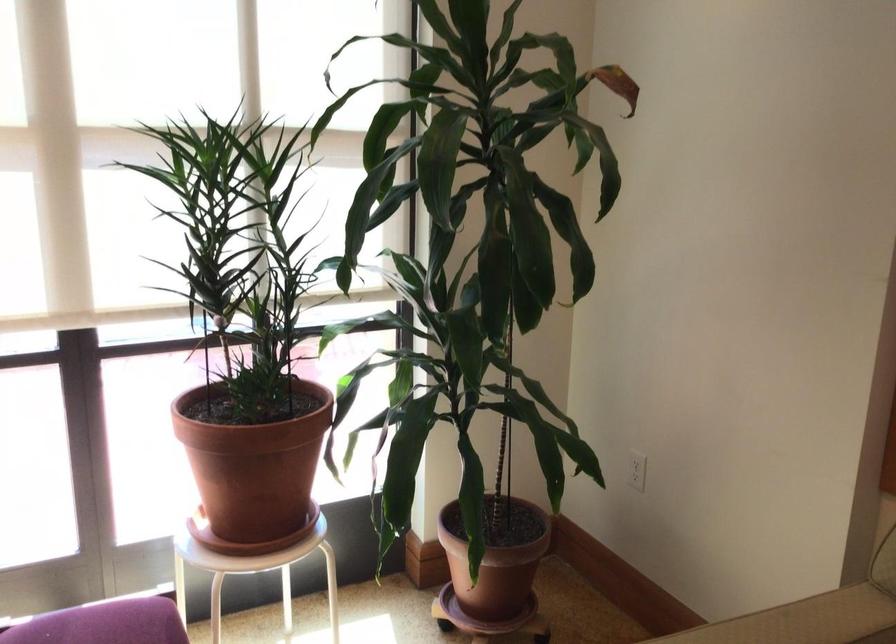
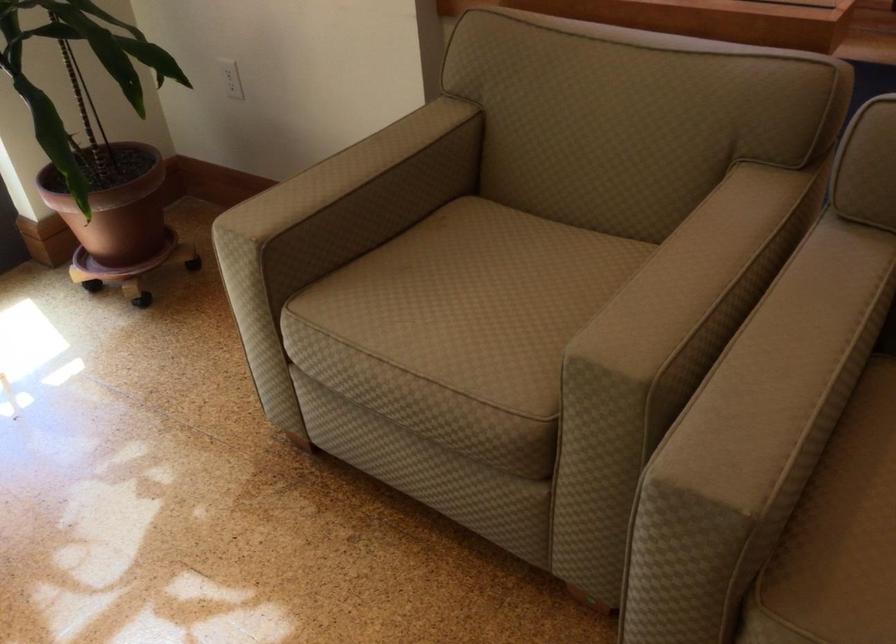
Locate, in the second image, the point that corresponds to the point at 636,469 in the first image.

(231, 79)